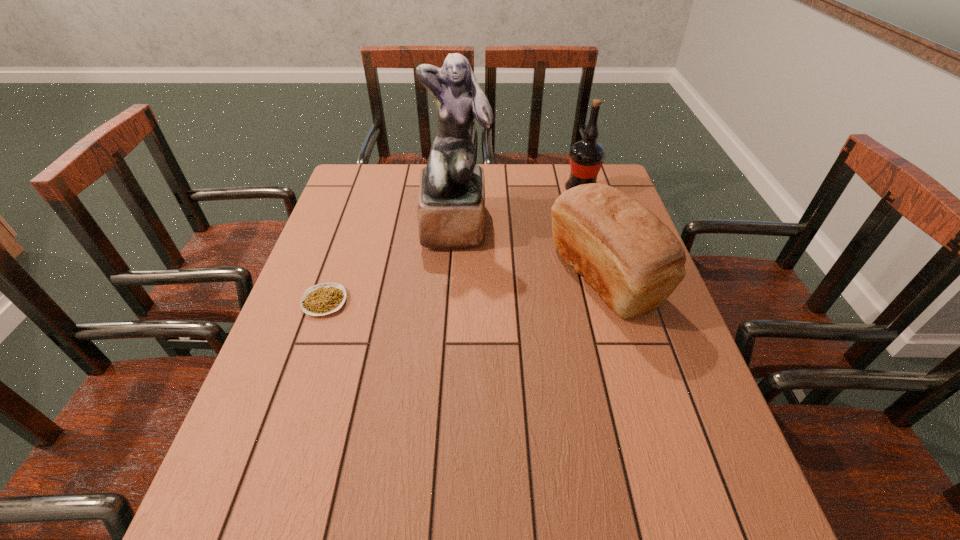
Find the location of a particular element. sculpture is located at coordinates (451, 204).

The height and width of the screenshot is (540, 960). What are the coordinates of `the second object from left to right` in the screenshot? It's located at (451, 204).

Locate an element on the screen. The width and height of the screenshot is (960, 540). the farthest object is located at coordinates (586, 156).

Locate an element on the screen. The width and height of the screenshot is (960, 540). the second tallest object is located at coordinates (586, 156).

I want to click on bread, so click(634, 261).

Where is `the leftmost object`? The width and height of the screenshot is (960, 540). the leftmost object is located at coordinates (325, 298).

Locate an element on the screen. The height and width of the screenshot is (540, 960). the shortest object is located at coordinates (325, 298).

Locate an element on the screen. This screenshot has height=540, width=960. vacant space located in a relaxed pose on the third object from right to left is located at coordinates (450, 319).

Where is `blank space located 0.250m on the front of the third shortest object`? The height and width of the screenshot is (540, 960). blank space located 0.250m on the front of the third shortest object is located at coordinates (599, 252).

Where is `vacant region located 0.150m on the back of the bread`? vacant region located 0.150m on the back of the bread is located at coordinates (583, 204).